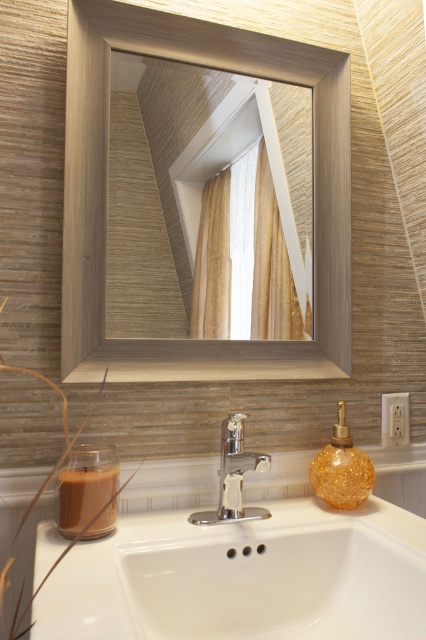
You are designing a bathroom layout and need to know the relative sizes of the objects in the scene. Which object, the matte wood mirror at upper center or the white textured curtain at upper center, takes up more space in the image?

The matte wood mirror at upper center is larger in size than the white textured curtain at upper center, so it takes up more space in the image.

You are a home inspector checking the bathroom layout. The building code requires that the distance between the matte wood mirror at upper center and the sink must be at least 36 inches. Does the current layout comply with this requirement?

The distance between the matte wood mirror at upper center and the sink is 37.29 inches, which exceeds the required 36 inches. Therefore, the layout complies with the building code.

You are a plumber checking the bathroom sink area. You need to determine if the white ceramic sink at center can be cleaned without touching the polished chrome faucet at center. Can you do that?

The white ceramic sink at center is not as tall as the polished chrome faucet at center, so yes, you can clean the white ceramic sink at center without touching the polished chrome faucet at center since it is shorter.